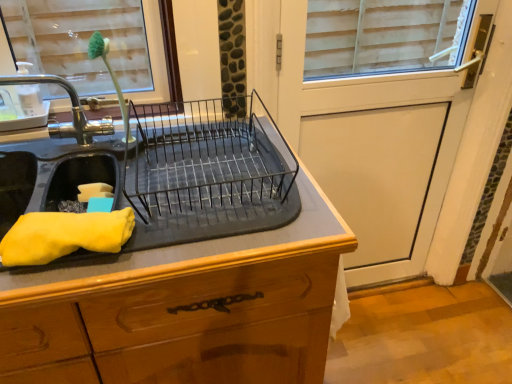
Question: Visually, is black metal dish rack at center positioned to the left or to the right of white matte screen door at upper right?

Choices:
 (A) right
 (B) left

Answer: (B)

Question: Does point (142, 162) appear closer or farther from the camera than point (402, 223)?

Choices:
 (A) closer
 (B) farther

Answer: (A)

Question: Based on their relative distances, which object is farther from the brushed metal tap at left?

Choices:
 (A) white matte screen door at upper right
 (B) yellow fabric at left
 (C) black rubber mat at center
 (D) black metal dish rack at center

Answer: (A)

Question: Which object is positioned closest to the white matte screen door at upper right?

Choices:
 (A) black rubber mat at center
 (B) yellow fabric at left
 (C) black metal dish rack at center
 (D) brushed metal tap at left

Answer: (C)